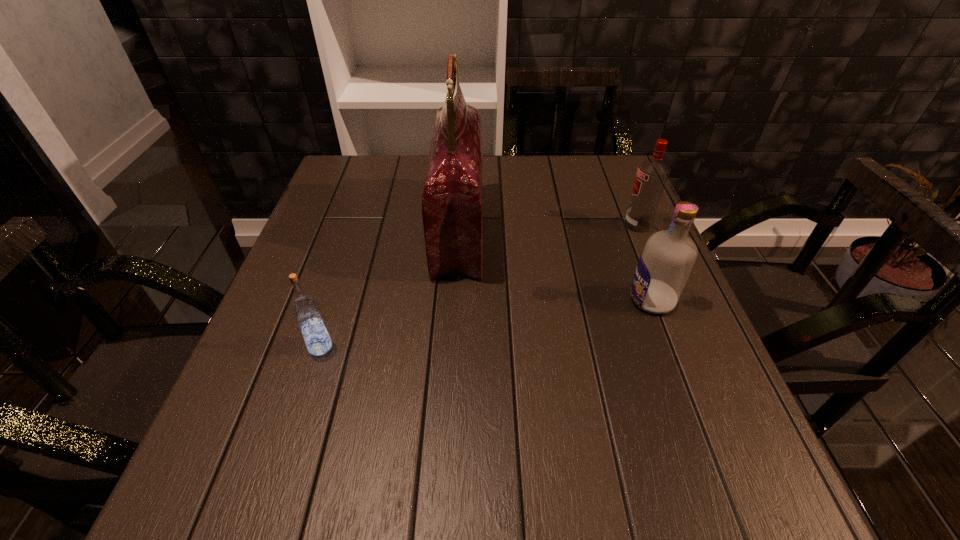
The height and width of the screenshot is (540, 960). Find the location of `free point located on the front label of the farthest vodka`. free point located on the front label of the farthest vodka is located at coordinates (509, 225).

You are a GUI agent. You are given a task and a screenshot of the screen. Output one action in this format:
    pyautogui.click(x=<x>, y=<y>)
    Task: Click on the vacant space positioned on the front label of the farthest vodka
    
    Given the screenshot: What is the action you would take?
    pyautogui.click(x=517, y=225)

I want to click on free location located 0.390m on the front label of the farthest vodka, so click(x=465, y=225).

This screenshot has height=540, width=960. What are the coordinates of `free space located on the back of the nearest vodka` in the screenshot? It's located at (355, 240).

Where is `object that is at the far edge`? This screenshot has width=960, height=540. object that is at the far edge is located at coordinates (452, 207).

Identify the location of object that is positioned at the left edge. The width and height of the screenshot is (960, 540). (305, 309).

Where is `free location at the far edge of the desktop`? The height and width of the screenshot is (540, 960). free location at the far edge of the desktop is located at coordinates (517, 198).

Image resolution: width=960 pixels, height=540 pixels. I want to click on vacant area at the near edge of the desktop, so click(x=514, y=465).

Where is `vacant space at the left edge of the desktop`? The height and width of the screenshot is (540, 960). vacant space at the left edge of the desktop is located at coordinates (268, 350).

The height and width of the screenshot is (540, 960). Find the location of `blank space at the right edge of the desktop`. blank space at the right edge of the desktop is located at coordinates (608, 261).